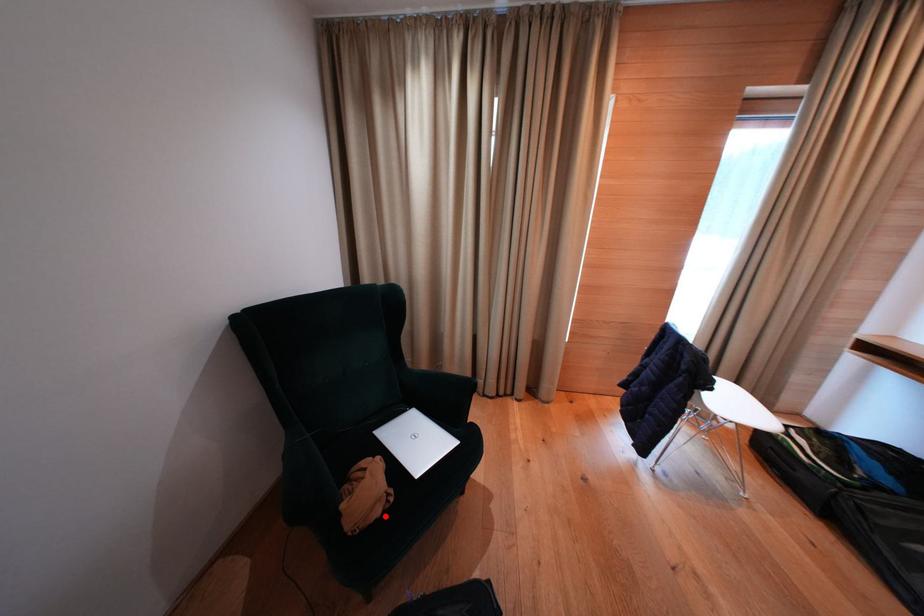
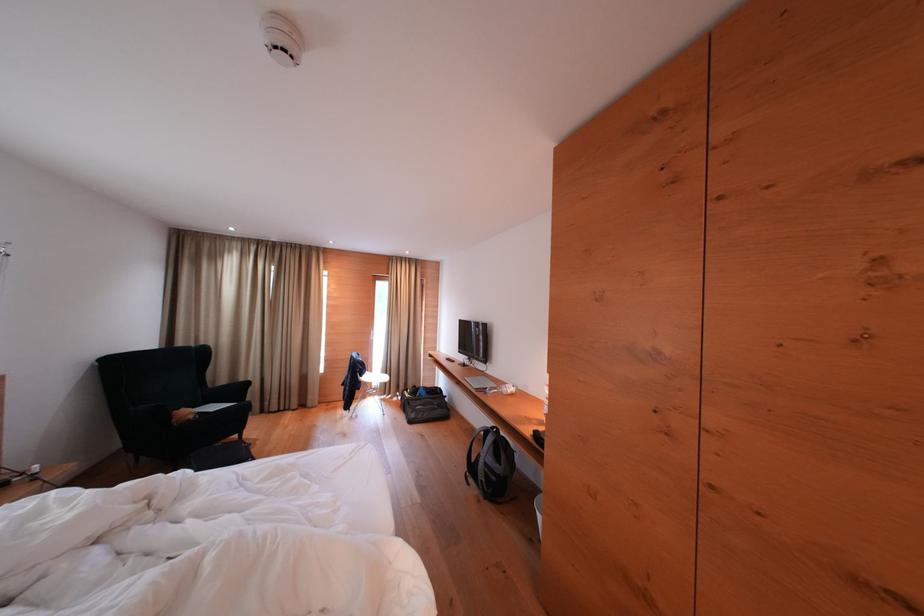
In the second image, find the point that corresponds to the highlighted location in the first image.

(198, 421)